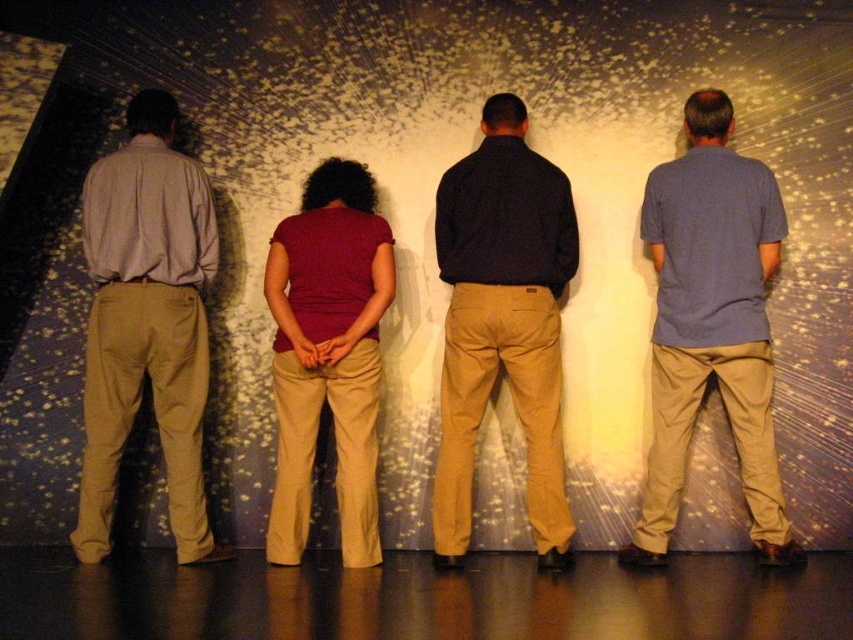
Describe the element at coordinates (146, 323) in the screenshot. Image resolution: width=853 pixels, height=640 pixels. I see `matte khaki pants at left` at that location.

Which of these two, matte khaki pants at left or matte red blouse at center, stands taller?

matte khaki pants at left

Which is in front, point (190, 518) or point (286, 429)?

Positioned in front is point (190, 518).

Image resolution: width=853 pixels, height=640 pixels. I want to click on matte khaki pants at left, so click(146, 323).

Is matte blue shirt at right closer to the viewer compared to matte red blouse at center?

Yes, matte blue shirt at right is in front of matte red blouse at center.

Locate an element on the screen. The height and width of the screenshot is (640, 853). matte blue shirt at right is located at coordinates (711, 324).

Measure the distance between matte blue shirt at right and dark blue shirt at center.

20.62 inches

Between point (701, 100) and point (523, 326), which one is positioned behind?

The point (701, 100) is behind.

Who is more distant from viewer, [767,253] or [556,301]?

The point [556,301] is behind.

Where is `matte blue shirt at right`? This screenshot has width=853, height=640. matte blue shirt at right is located at coordinates (711, 324).